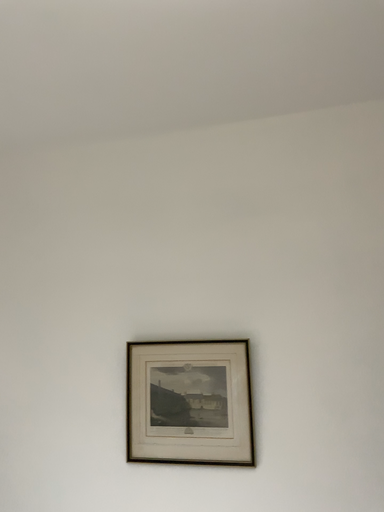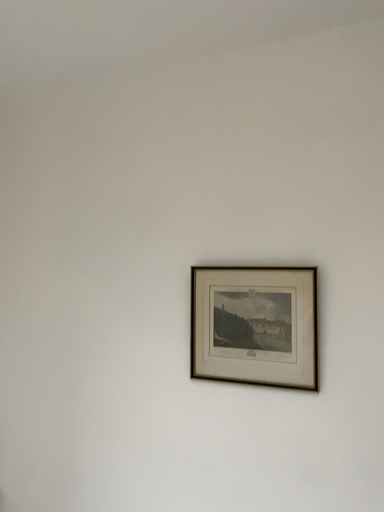
Question: Which way did the camera rotate in the video?

Choices:
 (A) rotated left
 (B) rotated right

Answer: (A)